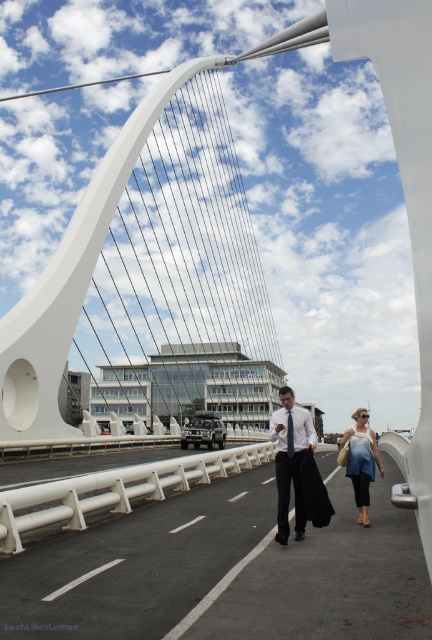
Does point (276, 476) come closer to viewer compared to point (352, 464)?

Yes, point (276, 476) is in front of point (352, 464).

Can you confirm if white shirt with tie at center is shorter than blue denim jacket at lower right?

Indeed, white shirt with tie at center has a lesser height compared to blue denim jacket at lower right.

What do you see at coordinates (291, 460) in the screenshot? I see `white shirt with tie at center` at bounding box center [291, 460].

Locate an element on the screen. Image resolution: width=432 pixels, height=640 pixels. white shirt with tie at center is located at coordinates (291, 460).